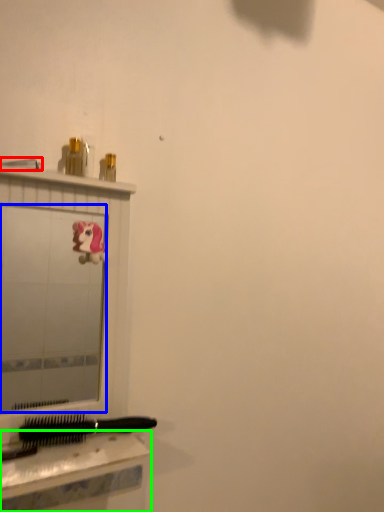
Question: Which object is the farthest from shower (highlighted by a red box)? Choose among these: mirror (highlighted by a blue box) or table (highlighted by a green box).

Choices:
 (A) mirror
 (B) table

Answer: (A)